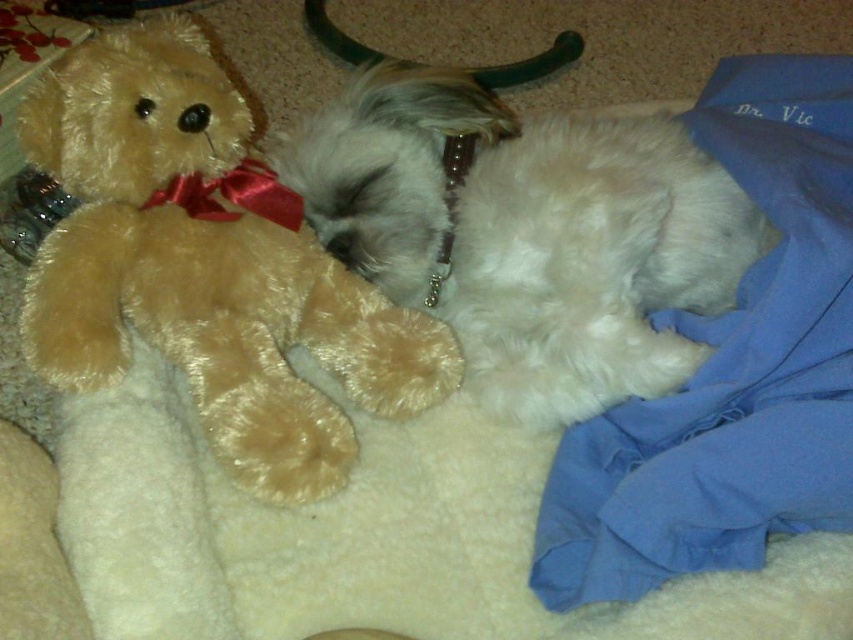
Who is positioned more to the right, soft brown plush bear at left or white fluffy dog at center?

white fluffy dog at center

Image resolution: width=853 pixels, height=640 pixels. Find the location of `soft brown plush bear at left`. soft brown plush bear at left is located at coordinates (206, 264).